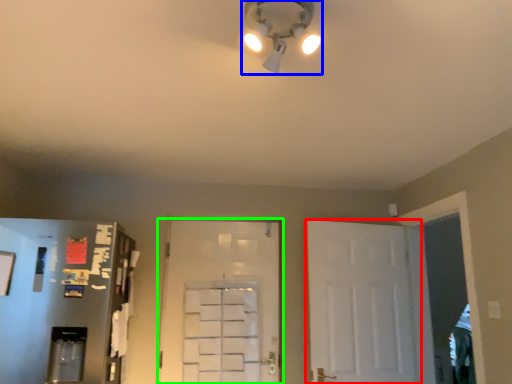
Question: Considering the real-world distances, which object is closest to door (highlighted by a red box)? light fixture (highlighted by a blue box) or door (highlighted by a green box).

Choices:
 (A) light fixture
 (B) door

Answer: (B)